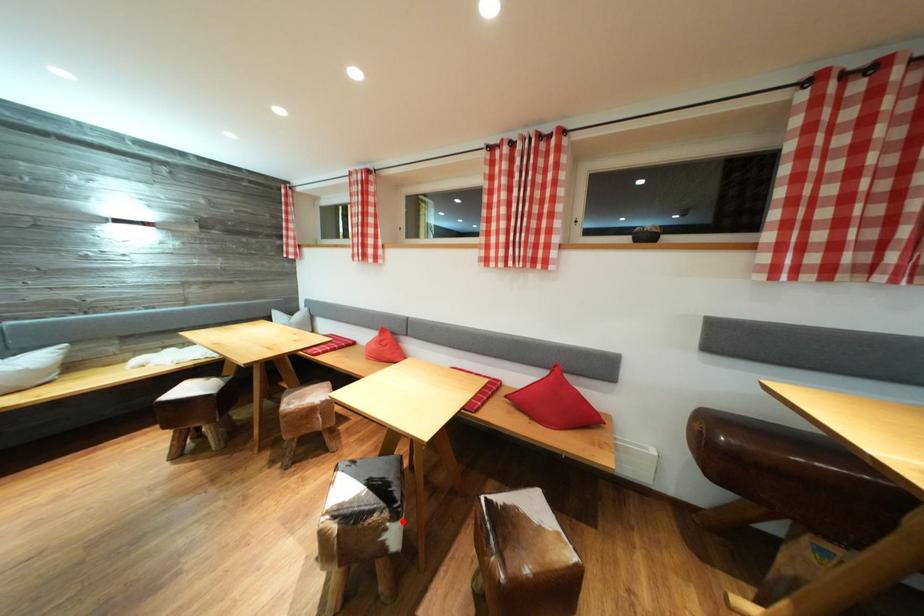
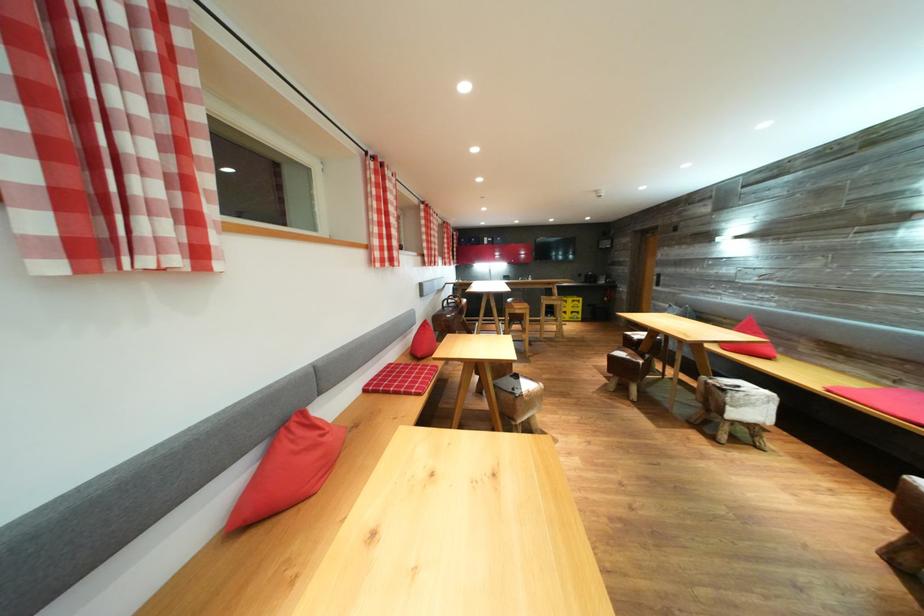
Question: I am providing you with two images of the same scene from different viewpoints. A red point is marked on the first image. Can you still see the location of the red point in image 2?

Choices:
 (A) Yes
 (B) No

Answer: (B)